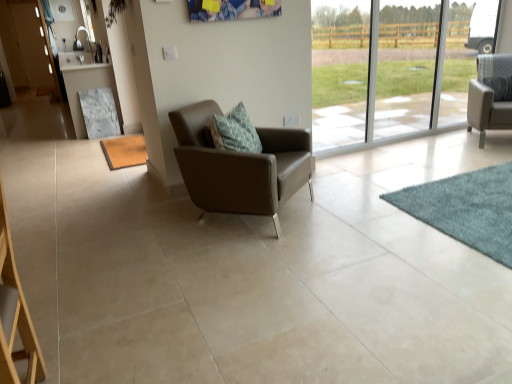
Locate an element on the screen. vacant space to the left of brown textured mat at lower left, the 2th mat ordered from the bottom is located at coordinates (74, 154).